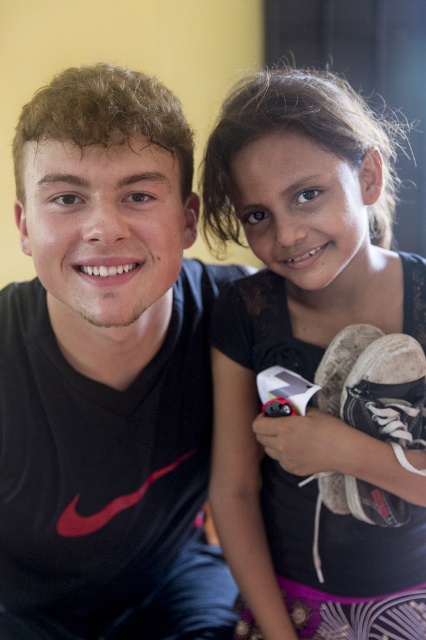
Question: Is black matte shirt at left below matte black dress at upper right?

Choices:
 (A) no
 (B) yes

Answer: (B)

Question: Can you confirm if black matte shirt at left is thinner than matte black dress at upper right?

Choices:
 (A) no
 (B) yes

Answer: (A)

Question: Is black matte shirt at left thinner than matte black dress at upper right?

Choices:
 (A) yes
 (B) no

Answer: (B)

Question: Which point appears closest to the camera in this image?

Choices:
 (A) (20, 132)
 (B) (261, 522)

Answer: (A)

Question: Which point appears closest to the camera in this image?

Choices:
 (A) (273, 496)
 (B) (123, 124)

Answer: (B)

Question: Which of the following is the closest to the observer?

Choices:
 (A) matte black dress at upper right
 (B) black matte shirt at left

Answer: (B)